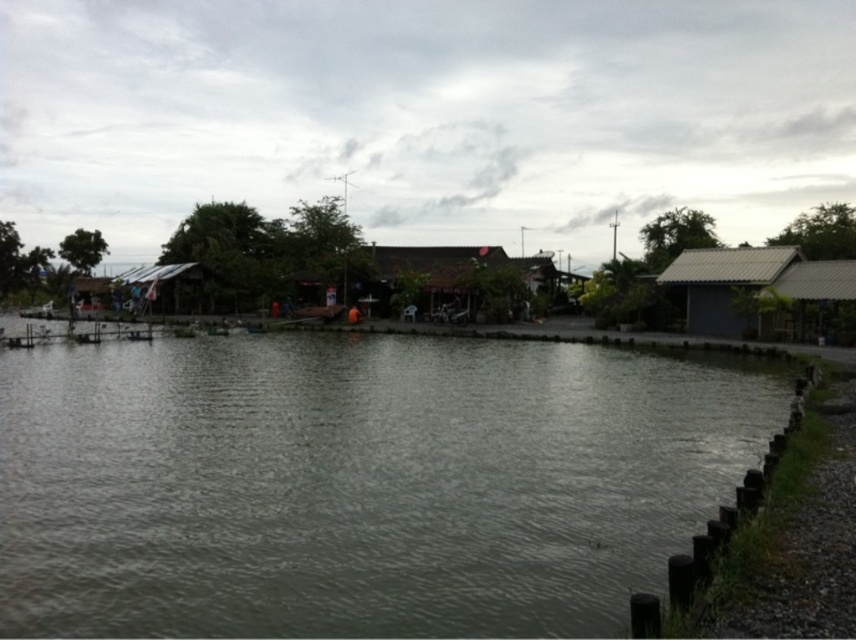
Question: Can you confirm if gray water at center is thinner than gray corrugated metal hut at right?

Choices:
 (A) no
 (B) yes

Answer: (A)

Question: Which of the following is the farthest from the observer?

Choices:
 (A) (324, 560)
 (B) (718, 324)

Answer: (B)

Question: Is gray water at center in front of gray corrugated metal hut at right?

Choices:
 (A) no
 (B) yes

Answer: (B)

Question: Is gray water at center to the right of gray corrugated metal hut at right from the viewer's perspective?

Choices:
 (A) no
 (B) yes

Answer: (A)

Question: Which point is closer to the camera?

Choices:
 (A) gray water at center
 (B) gray corrugated metal hut at right

Answer: (A)

Question: Which object is farther from the camera taking this photo?

Choices:
 (A) gray water at center
 (B) gray corrugated metal hut at right

Answer: (B)